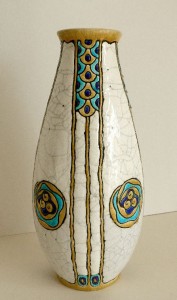
The image size is (177, 300). What are the coordinates of `background surface` in the screenshot? It's located at (154, 153), (20, 164).